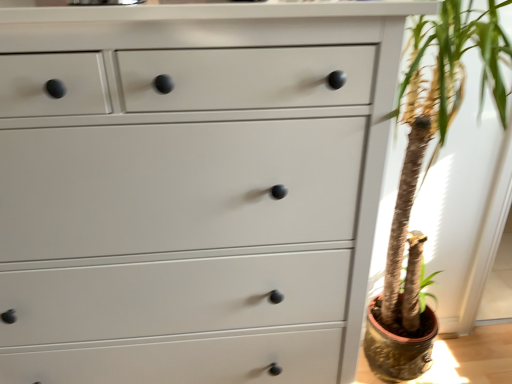
Where is `brown textured plant at right`? This screenshot has height=384, width=512. brown textured plant at right is located at coordinates (429, 168).

Image resolution: width=512 pixels, height=384 pixels. What do you see at coordinates (429, 168) in the screenshot?
I see `brown textured plant at right` at bounding box center [429, 168].

Where is `brown textured plant at right`? The width and height of the screenshot is (512, 384). brown textured plant at right is located at coordinates (429, 168).